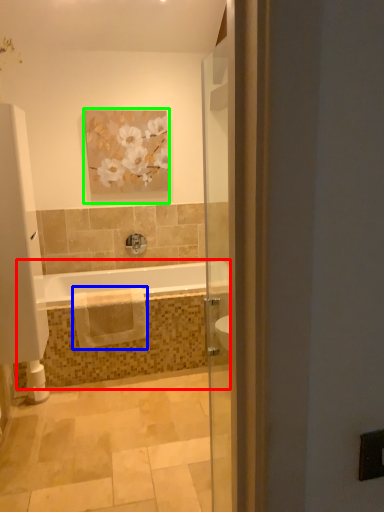
Question: Considering the real-world distances, which object is farthest from bath (highlighted by a red box)? material (highlighted by a blue box) or picture frame (highlighted by a green box)?

Choices:
 (A) material
 (B) picture frame

Answer: (B)